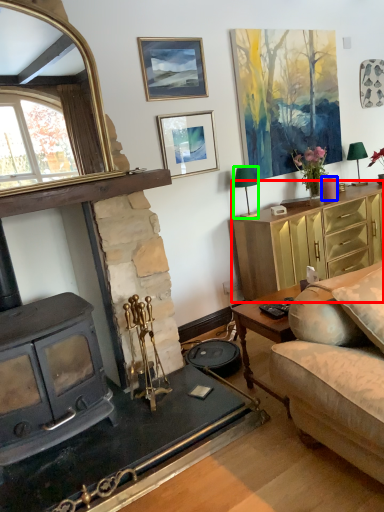
Question: Which object is positioned closest to cabinetry (highlighted by a red box)? Select from candle (highlighted by a blue box) and lamp (highlighted by a green box).

Choices:
 (A) candle
 (B) lamp

Answer: (A)